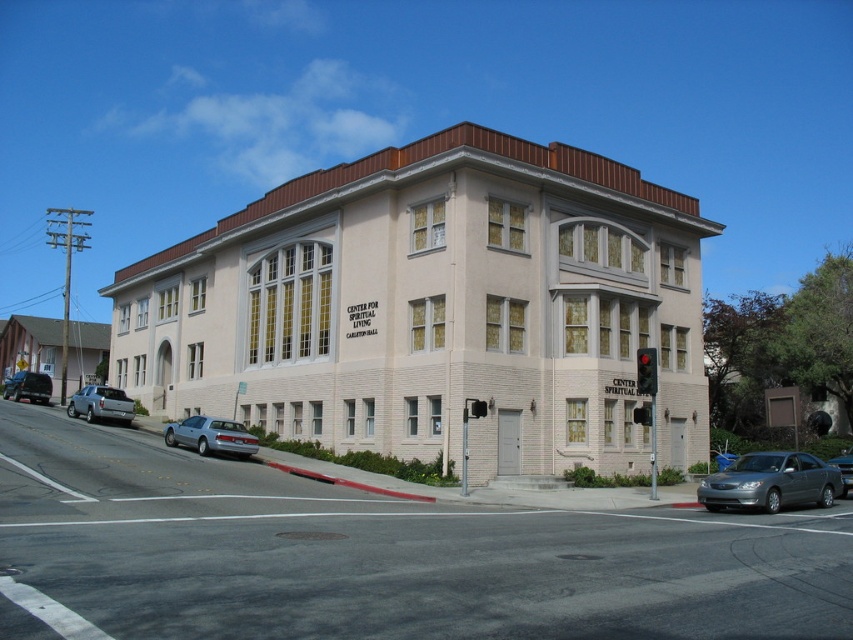
Question: Is gray metallic sedan at lower right to the right of silver metallic sedan at lower left from the viewer's perspective?

Choices:
 (A) no
 (B) yes

Answer: (B)

Question: Where is smooth asphalt road at center located in relation to silver metallic sedan at center in the image?

Choices:
 (A) right
 (B) left

Answer: (B)

Question: Which is farther from the silver metallic sedan at center?

Choices:
 (A) silver metallic sedan at lower left
 (B) gray metallic sedan at lower right
 (C) matte black suv at lower left

Answer: (C)

Question: Which point is closer to the camera?

Choices:
 (A) silver metallic sedan at center
 (B) matte black suv at lower left
 (C) silver metallic suv at lower left
 (D) smooth asphalt road at center

Answer: (D)

Question: Can you confirm if gray metallic sedan at lower right is positioned to the left of matte black suv at lower left?

Choices:
 (A) yes
 (B) no

Answer: (B)

Question: Which of the following is the farthest from the observer?

Choices:
 (A) silver metallic sedan at lower left
 (B) matte black suv at lower left
 (C) gray metallic sedan at lower right
 (D) silver metallic sedan at center

Answer: (B)